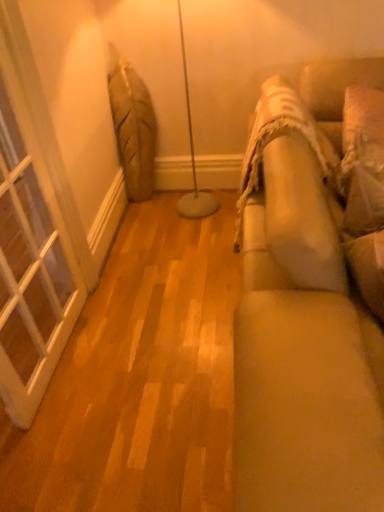
Question: Is beige fabric couch at right outside white glass window at left?

Choices:
 (A) yes
 (B) no

Answer: (A)

Question: Is beige fabric couch at right smaller than white glass window at left?

Choices:
 (A) no
 (B) yes

Answer: (A)

Question: Considering the relative sizes of beige fabric couch at right and white glass window at left in the image provided, is beige fabric couch at right taller than white glass window at left?

Choices:
 (A) yes
 (B) no

Answer: (B)

Question: Can you confirm if beige fabric couch at right is positioned to the right of white glass window at left?

Choices:
 (A) yes
 (B) no

Answer: (A)

Question: From the image's perspective, is beige fabric couch at right located beneath white glass window at left?

Choices:
 (A) no
 (B) yes

Answer: (B)

Question: Does beige fabric couch at right have a larger size compared to white glass window at left?

Choices:
 (A) no
 (B) yes

Answer: (B)

Question: From a real-world perspective, is white textured pillow at right beneath white glass window at left?

Choices:
 (A) yes
 (B) no

Answer: (A)

Question: Are white textured pillow at right and white glass window at left beside each other?

Choices:
 (A) no
 (B) yes

Answer: (A)

Question: Is white textured pillow at right wider than white glass window at left?

Choices:
 (A) no
 (B) yes

Answer: (B)

Question: From the image's perspective, is white textured pillow at right below white glass window at left?

Choices:
 (A) yes
 (B) no

Answer: (B)

Question: Could you tell me if white textured pillow at right is facing white glass window at left?

Choices:
 (A) yes
 (B) no

Answer: (B)

Question: Is white textured pillow at right at the left side of white glass window at left?

Choices:
 (A) no
 (B) yes

Answer: (A)

Question: Is white textured pillow at right closer to camera compared to beige fabric couch at right?

Choices:
 (A) no
 (B) yes

Answer: (A)